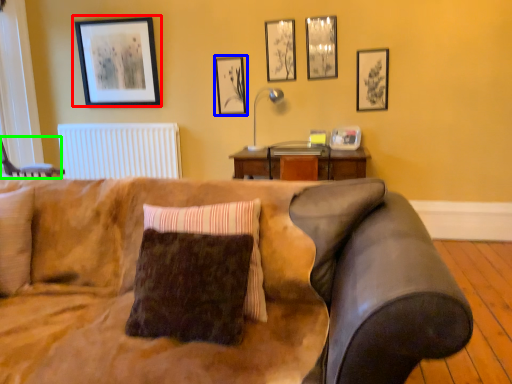
Question: Considering the real-world distances, which object is farthest from picture frame (highlighted by a red box)? picture frame (highlighted by a blue box) or swivel chair (highlighted by a green box)?

Choices:
 (A) picture frame
 (B) swivel chair

Answer: (B)